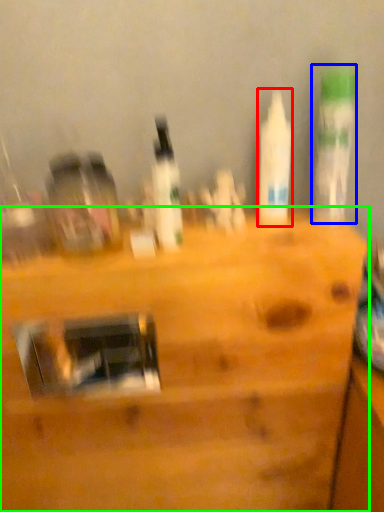
Question: Based on their relative distances, which object is nearer to bottle (highlighted by a red box)? Choose from bottle (highlighted by a blue box) and furniture (highlighted by a green box).

Choices:
 (A) bottle
 (B) furniture

Answer: (A)